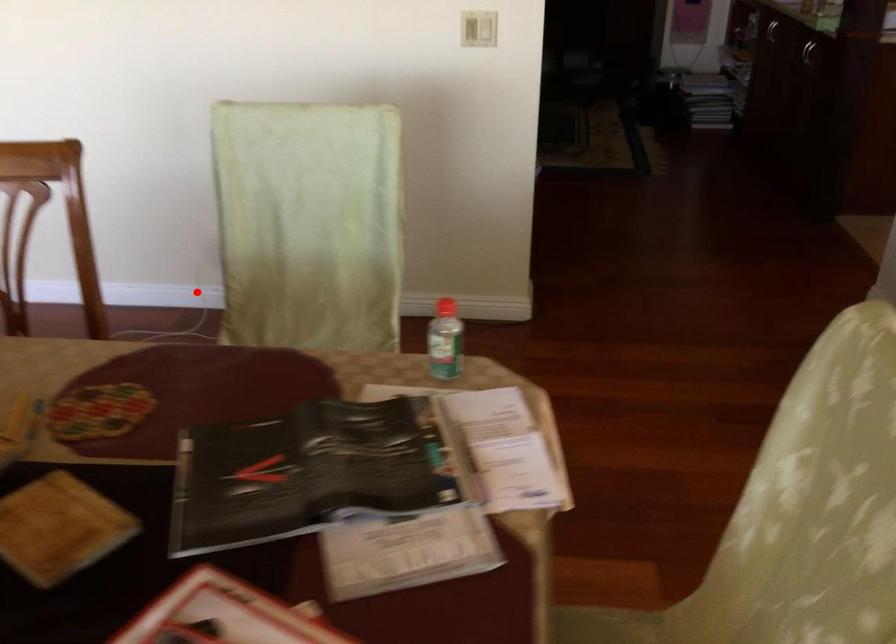
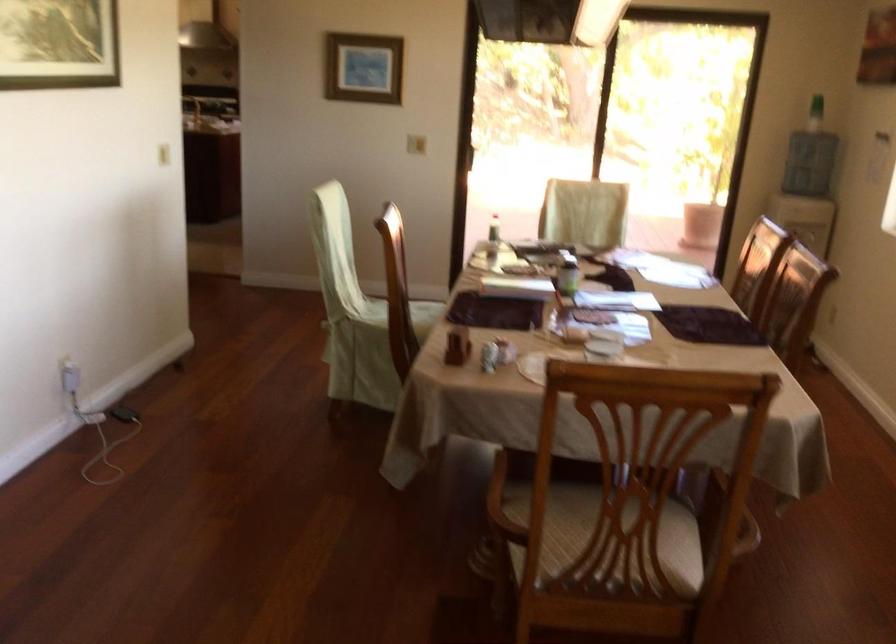
Locate, in the second image, the point that corresponds to the highlighted location in the first image.

(97, 424)